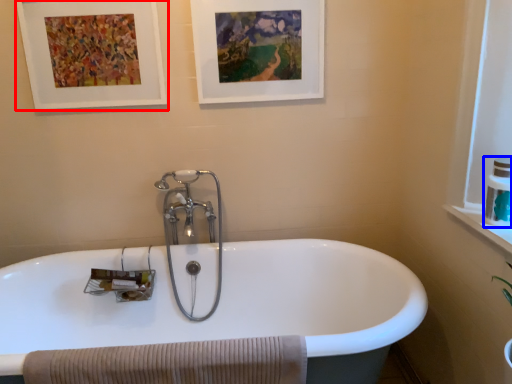
Question: Which point is further to the camera, picture frame (highlighted by a red box) or toiletry (highlighted by a blue box)?

Choices:
 (A) picture frame
 (B) toiletry

Answer: (A)